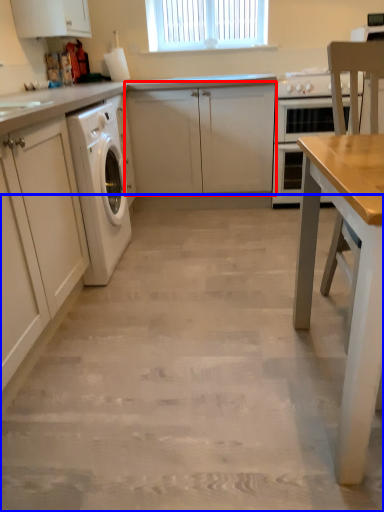
Question: Which object appears farthest to the camera in this image, cabinetry (highlighted by a red box) or concrete (highlighted by a blue box)?

Choices:
 (A) cabinetry
 (B) concrete

Answer: (A)